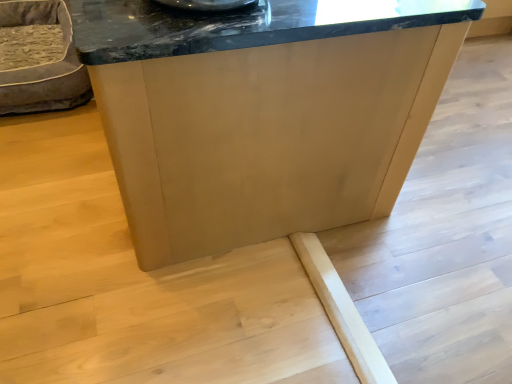
Question: Is matte wood table at center inside the boundaries of velvet grey pet bed at left, or outside?

Choices:
 (A) inside
 (B) outside

Answer: (B)

Question: From the image's perspective, is matte wood table at center above or below velvet grey pet bed at left?

Choices:
 (A) below
 (B) above

Answer: (A)

Question: Based on their sizes in the image, would you say matte wood table at center is bigger or smaller than velvet grey pet bed at left?

Choices:
 (A) small
 (B) big

Answer: (B)

Question: From the image's perspective, is velvet grey pet bed at left above or below matte wood table at center?

Choices:
 (A) above
 (B) below

Answer: (A)

Question: Is point (81, 66) closer or farther from the camera than point (117, 69)?

Choices:
 (A) farther
 (B) closer

Answer: (A)

Question: Looking at the image, does velvet grey pet bed at left seem bigger or smaller compared to matte wood table at center?

Choices:
 (A) small
 (B) big

Answer: (A)

Question: In the image, is velvet grey pet bed at left positioned in front of or behind matte wood table at center?

Choices:
 (A) behind
 (B) front

Answer: (A)